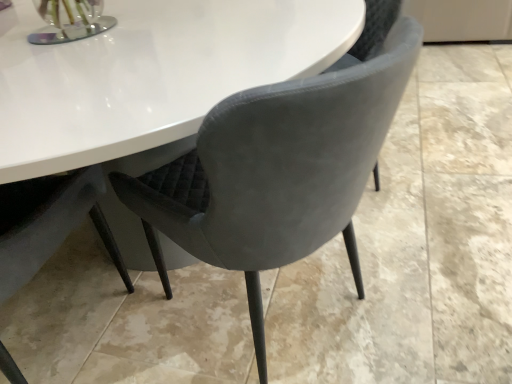
Identify the location of velvet grey chair at center. The image size is (512, 384). click(279, 170).

This screenshot has height=384, width=512. Describe the element at coordinates (279, 170) in the screenshot. I see `velvet grey chair at center` at that location.

Locate an element on the screen. The height and width of the screenshot is (384, 512). velvet grey chair at center is located at coordinates [279, 170].